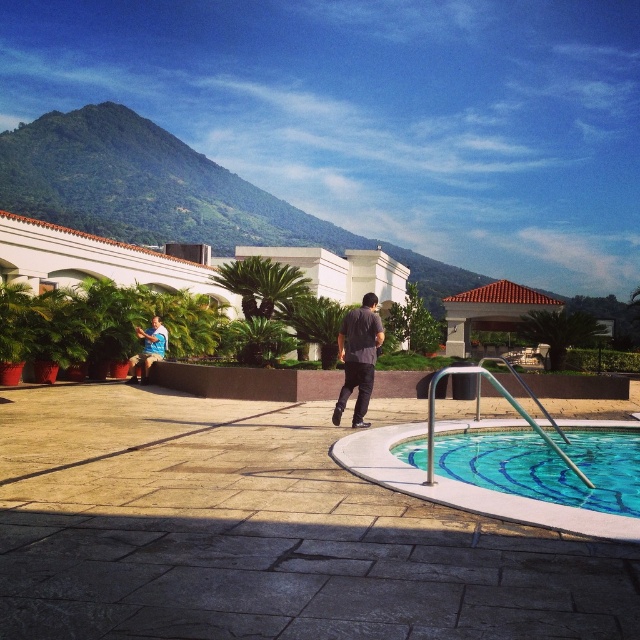
You are standing at the camera position and want to take a photo of the green leafy mountain at upper left. If your camera can focus on objects up to 50 meters away, will it be able to capture the mountain clearly?

The green leafy mountain at upper left is 44.30 meters away from the camera, which is within the 50 meters focusing range. Therefore, the camera should be able to capture the mountain clearly.

You are standing at the center of the paved area in the foreground of the scene. Looking towards the upper left corner, you notice a point marked at coordinates (144, 186). What object is located at this point?

The point at (144, 186) marks the green leafy mountain at upper left.

You are standing at the center of the paved area in the foreground and want to walk directly to the clear glass pool at lower right. According to the coordinates provided, in which direction should you move?

The clear glass pool at lower right is located at coordinates point (547,465), so you should move towards the lower right direction to reach it.